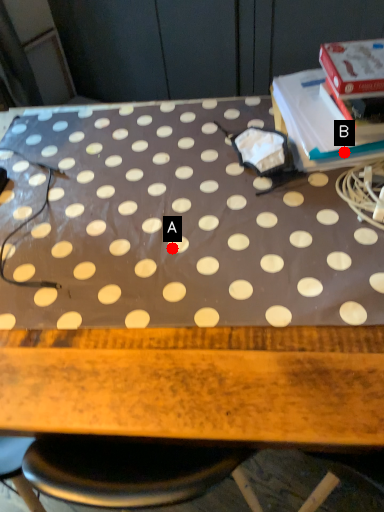
Question: Two points are circled on the image, labeled by A and B beside each circle. Which point is farther to the camera?

Choices:
 (A) A is further
 (B) B is further

Answer: (B)